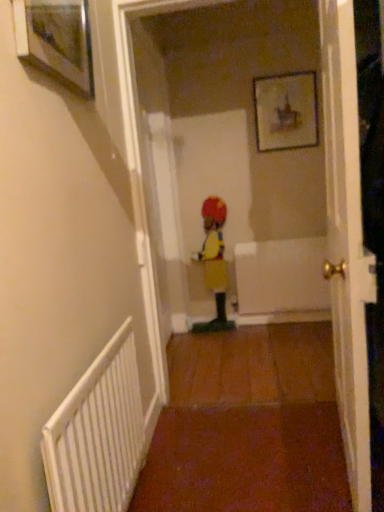
Question: In which direction should I rotate to look at wooden picture frame at upper center, placed as the 1th picture frame when sorted from right to left?

Choices:
 (A) right
 (B) left

Answer: (A)

Question: Is the position of wooden picture frame at upper center, which is the 2th picture frame from left to right, less distant than that of white textured radiator at lower left?

Choices:
 (A) no
 (B) yes

Answer: (A)

Question: From a real-world perspective, does wooden picture frame at upper center, the 2th picture frame when ordered from front to back, sit lower than white textured radiator at lower left?

Choices:
 (A) no
 (B) yes

Answer: (A)

Question: Can you confirm if wooden picture frame at upper center, the first picture frame when ordered from back to front, is bigger than white textured radiator at lower left?

Choices:
 (A) no
 (B) yes

Answer: (A)

Question: Is white textured radiator at lower left a part of wooden picture frame at upper center, the 2th picture frame when ordered from front to back?

Choices:
 (A) no
 (B) yes

Answer: (A)

Question: Could you tell me if wooden picture frame at upper center, placed as the 1th picture frame when sorted from right to left, is facing white textured radiator at lower left?

Choices:
 (A) yes
 (B) no

Answer: (A)

Question: From the image's perspective, is wooden picture frame at upper center, the 2th picture frame when ordered from front to back, located above white textured radiator at lower left?

Choices:
 (A) yes
 (B) no

Answer: (A)

Question: From the image's perspective, would you say white glossy door at center is shown under wooden framed picture at upper left, acting as the 1th picture frame starting from the left?

Choices:
 (A) no
 (B) yes

Answer: (B)

Question: Is white glossy door at center outside of wooden framed picture at upper left, acting as the 1th picture frame starting from the left?

Choices:
 (A) yes
 (B) no

Answer: (A)

Question: From a real-world perspective, is white glossy door at center positioned over wooden framed picture at upper left, acting as the 1th picture frame starting from the left, based on gravity?

Choices:
 (A) no
 (B) yes

Answer: (A)

Question: Is white glossy door at center surrounding wooden framed picture at upper left, the 2th picture frame from the back?

Choices:
 (A) yes
 (B) no

Answer: (B)

Question: Is white glossy door at center facing away from wooden framed picture at upper left, which ranks as the 2th picture frame in right-to-left order?

Choices:
 (A) yes
 (B) no

Answer: (B)

Question: Is white glossy door at center closer to camera compared to wooden framed picture at upper left, acting as the first picture frame starting from the front?

Choices:
 (A) no
 (B) yes

Answer: (B)

Question: Is white glossy door at center further to camera compared to yellow fabric clown at center?

Choices:
 (A) yes
 (B) no

Answer: (B)